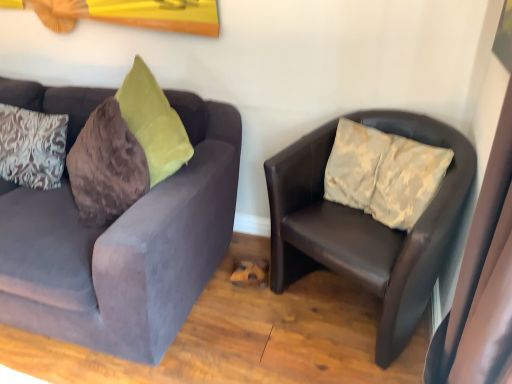
Describe the element at coordinates (365, 225) in the screenshot. This screenshot has width=512, height=384. I see `leather chair at right, the 2th studio couch viewed from the left` at that location.

Identify the location of velvet gray couch at left, which ranks as the first studio couch in left-to-right order. The height and width of the screenshot is (384, 512). (124, 247).

Is white damask pillow at left situated inside velvet gray couch at left, the 2th studio couch viewed from the right, or outside?

white damask pillow at left is enclosed within velvet gray couch at left, the 2th studio couch viewed from the right.

Considering the relative sizes of white damask pillow at left and velvet gray couch at left, which ranks as the first studio couch in left-to-right order, in the image provided, is white damask pillow at left thinner than velvet gray couch at left, which ranks as the first studio couch in left-to-right order,?

Indeed, white damask pillow at left has a lesser width compared to velvet gray couch at left, which ranks as the first studio couch in left-to-right order.

Can you tell me how much white damask pillow at left and velvet gray couch at left, the 2th studio couch viewed from the right, differ in facing direction?

The angle between the facing direction of white damask pillow at left and the facing direction of velvet gray couch at left, the 2th studio couch viewed from the right, is 3.29 degrees.

Is white damask pillow at left beside velvet gray couch at left, the 2th studio couch viewed from the right?

No, white damask pillow at left is not next to velvet gray couch at left, the 2th studio couch viewed from the right.

Can you see leather chair at right, acting as the 1th studio couch starting from the right, touching white damask pillow at left?

leather chair at right, acting as the 1th studio couch starting from the right, and white damask pillow at left are clearly separated.

Is leather chair at right, acting as the 1th studio couch starting from the right, not inside white damask pillow at left?

Yes, leather chair at right, acting as the 1th studio couch starting from the right, is outside of white damask pillow at left.

Who is taller, leather chair at right, acting as the 1th studio couch starting from the right, or white damask pillow at left?

leather chair at right, acting as the 1th studio couch starting from the right, is taller.

Based on the photo, from a real-world perspective, is leather chair at right, acting as the 1th studio couch starting from the right, below white damask pillow at left?

Correct, in the physical world, leather chair at right, acting as the 1th studio couch starting from the right, is lower than white damask pillow at left.

Considering the positions of objects velvet gray couch at left, which ranks as the first studio couch in left-to-right order, and white damask pillow at left in the image provided, who is behind, velvet gray couch at left, which ranks as the first studio couch in left-to-right order, or white damask pillow at left?

white damask pillow at left is further from the camera.

Based on their sizes in the image, would you say velvet gray couch at left, which ranks as the first studio couch in left-to-right order, is bigger or smaller than white damask pillow at left?

In the image, velvet gray couch at left, which ranks as the first studio couch in left-to-right order, appears to be larger than white damask pillow at left.

From the image's perspective, between velvet gray couch at left, which ranks as the first studio couch in left-to-right order, and white damask pillow at left, who is located below?

velvet gray couch at left, which ranks as the first studio couch in left-to-right order.

From a real-world perspective, is leather chair at right, the 2th studio couch viewed from the left, physically above velvet gray couch at left, which ranks as the first studio couch in left-to-right order?

No, from a real-world perspective, leather chair at right, the 2th studio couch viewed from the left, is not over velvet gray couch at left, which ranks as the first studio couch in left-to-right order

Can you see leather chair at right, acting as the 1th studio couch starting from the right, touching velvet gray couch at left, the 2th studio couch viewed from the right?

They are not placed beside each other.

Image resolution: width=512 pixels, height=384 pixels. Identify the location of studio couch that is above the leather chair at right, acting as the 1th studio couch starting from the right (from the image's perspective). (124, 247).

Is leather chair at right, the 2th studio couch viewed from the left, closer to camera compared to velvet gray couch at left, the 2th studio couch viewed from the right?

No, the depth of leather chair at right, the 2th studio couch viewed from the left, is greater than that of velvet gray couch at left, the 2th studio couch viewed from the right.

From the image's perspective, is white damask pillow at left below leather chair at right, acting as the 1th studio couch starting from the right?

Actually, white damask pillow at left appears above leather chair at right, acting as the 1th studio couch starting from the right, in the image.

Where is `pillow above the leather chair at right, the 2th studio couch viewed from the left (from the image's perspective)`? pillow above the leather chair at right, the 2th studio couch viewed from the left (from the image's perspective) is located at coordinates (32, 147).

How different are the orientations of white damask pillow at left and leather chair at right, acting as the 1th studio couch starting from the right, in degrees?

22.9 degrees separate the facing orientations of white damask pillow at left and leather chair at right, acting as the 1th studio couch starting from the right.

How different are the orientations of velvet gray couch at left, the 2th studio couch viewed from the right, and leather chair at right, the 2th studio couch viewed from the left, in degrees?

26.2 degrees separate the facing orientations of velvet gray couch at left, the 2th studio couch viewed from the right, and leather chair at right, the 2th studio couch viewed from the left.

Looking at this image, which point is more forward, (2,314) or (461,134)?

Positioned in front is point (461,134).

Considering the sizes of velvet gray couch at left, the 2th studio couch viewed from the right, and leather chair at right, the 2th studio couch viewed from the left, in the image, is velvet gray couch at left, the 2th studio couch viewed from the right, wider or thinner than leather chair at right, the 2th studio couch viewed from the left,?

In the image, velvet gray couch at left, the 2th studio couch viewed from the right, appears to be wider than leather chair at right, the 2th studio couch viewed from the left.

In terms of size, does velvet gray couch at left, which ranks as the first studio couch in left-to-right order, appear bigger or smaller than leather chair at right, the 2th studio couch viewed from the left?

velvet gray couch at left, which ranks as the first studio couch in left-to-right order, is bigger than leather chair at right, the 2th studio couch viewed from the left.

Where is `the 1st studio couch positioned below the white damask pillow at left (from a real-world perspective)`? This screenshot has width=512, height=384. the 1st studio couch positioned below the white damask pillow at left (from a real-world perspective) is located at coordinates (124, 247).

In order to click on pillow above the leather chair at right, acting as the 1th studio couch starting from the right (from a real-world perspective) in this screenshot , I will do `click(32, 147)`.

Which object lies further to the anchor point white damask pillow at left, leather chair at right, the 2th studio couch viewed from the left, or velvet gray couch at left, the 2th studio couch viewed from the right?

leather chair at right, the 2th studio couch viewed from the left.

Estimate the real-world distances between objects in this image. Which object is closer to white damask pillow at left, velvet gray couch at left, which ranks as the first studio couch in left-to-right order, or leather chair at right, the 2th studio couch viewed from the left?

Based on the image, velvet gray couch at left, which ranks as the first studio couch in left-to-right order, appears to be nearer to white damask pillow at left.

From the image, which object appears to be nearer to leather chair at right, the 2th studio couch viewed from the left, velvet gray couch at left, the 2th studio couch viewed from the right, or white damask pillow at left?

velvet gray couch at left, the 2th studio couch viewed from the right, is positioned closer to the anchor leather chair at right, the 2th studio couch viewed from the left.

From the image, which object appears to be farther from leather chair at right, the 2th studio couch viewed from the left, white damask pillow at left or velvet gray couch at left, which ranks as the first studio couch in left-to-right order?

white damask pillow at left is further to leather chair at right, the 2th studio couch viewed from the left.

When comparing their distances from velvet gray couch at left, the 2th studio couch viewed from the right, does white damask pillow at left or leather chair at right, the 2th studio couch viewed from the left, seem further?

Among the two, leather chair at right, the 2th studio couch viewed from the left, is located further to velvet gray couch at left, the 2th studio couch viewed from the right.

From the picture: Looking at the image, which one is located closer to velvet gray couch at left, which ranks as the first studio couch in left-to-right order, leather chair at right, the 2th studio couch viewed from the left, or white damask pillow at left?

The object closer to velvet gray couch at left, which ranks as the first studio couch in left-to-right order, is white damask pillow at left.

You are a GUI agent. You are given a task and a screenshot of the screen. Output one action in this format:
    pyautogui.click(x=<x>, y=<y>)
    Task: Click on the studio couch between white damask pillow at left and leather chair at right, acting as the 1th studio couch starting from the right, in the horizontal direction
    The width and height of the screenshot is (512, 384).
    Given the screenshot: What is the action you would take?
    pyautogui.click(x=124, y=247)